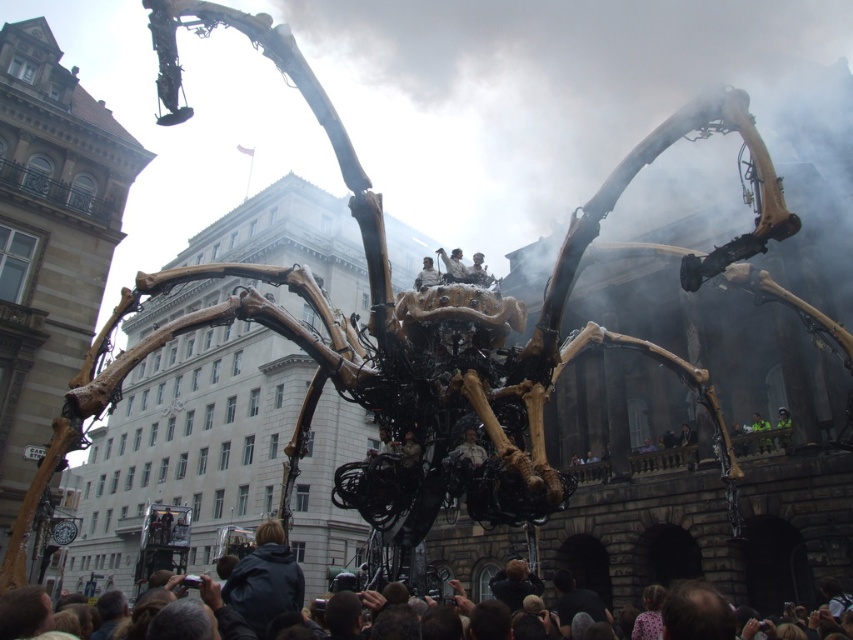
You are a photographer at the event and want to capture both the dark blue jacket at lower center and the white fabric person at center in the same frame. Which object should you focus on first to ensure both are in focus?

The dark blue jacket at lower center is larger in size than the white fabric person at center, so focusing on the larger object first would help ensure both are in focus.

You are a photographer trying to capture a clear shot of the smooth brown fur at center without the dark blue jacket at lower center blocking it. Which object should you move closer to or farther from to achieve this?

To avoid the dark blue jacket at lower center blocking the smooth brown fur at center, you should move closer to the smooth brown fur at center. Since the dark blue jacket at lower center might be wider than the smooth brown fur at center, moving closer would reduce the jacket appearing larger in the frame, allowing the fur to be more visible.